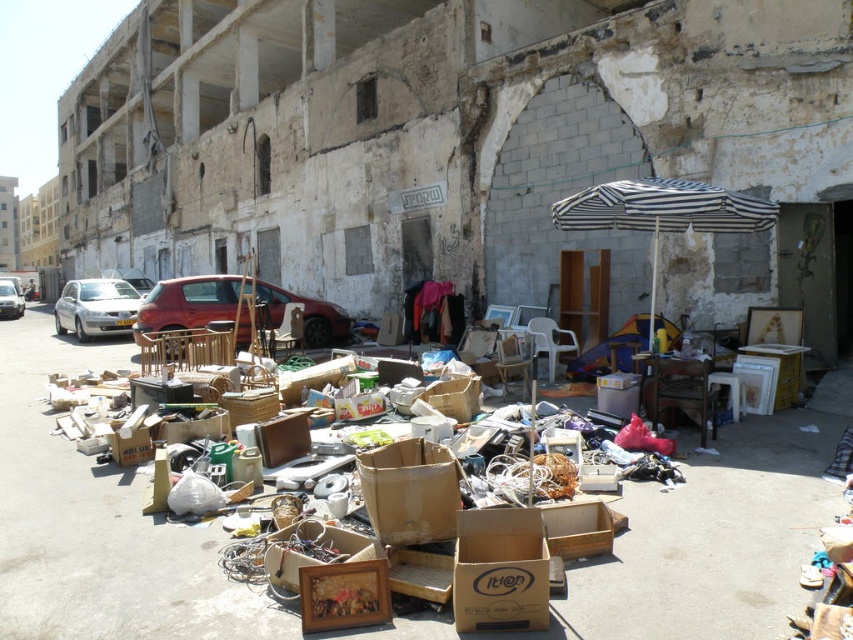
You are a delivery driver who needs to navigate through the cluttered area to reach the partially demolished building. You see a metallic red car at center and a silver metallic van at center. Which vehicle should you avoid to keep moving towards the building?

You should avoid the silver metallic van at center because the metallic red car at center is to the right of it, so moving around the van would provide a clearer path towards the building.

You are a delivery person trying to navigate through the cluttered area in the image. There are brown cardboard boxes at center in the way. Can you estimate their position relative to the center of the image to plan your path?

The brown cardboard boxes at center are located at the point 0.822 on the x axis and 0.116 on the y axis, which means they are positioned to the right and slightly below the center of the image.

You are a delivery person who needs to navigate through the cluttered area in the image to reach the partially demolished building in the background. The delivery cart you are pushing is 1.2 meters wide. Can you safely pass through the area near the brown cardboard boxes at center without hitting the cart against any obstacles?

The distance between the brown cardboard boxes at center and the camera is 3.32 meters. Since the cart is only 1.2 meters wide, there should be enough space to navigate around the boxes as long as there are no other obstacles in the immediate vicinity. However, the answer depends on the arrangement of other debris not specified in the provided details.